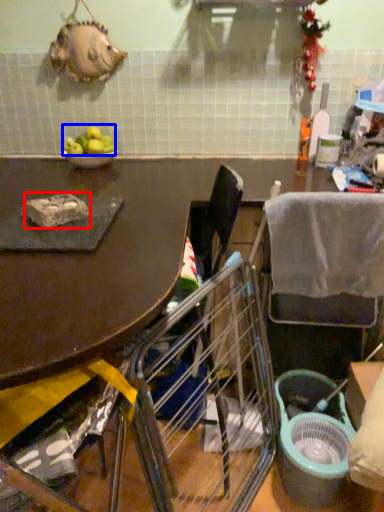
Question: Which of the following is the closest to the observer, food (highlighted by a red box) or fruit (highlighted by a blue box)?

Choices:
 (A) food
 (B) fruit

Answer: (A)